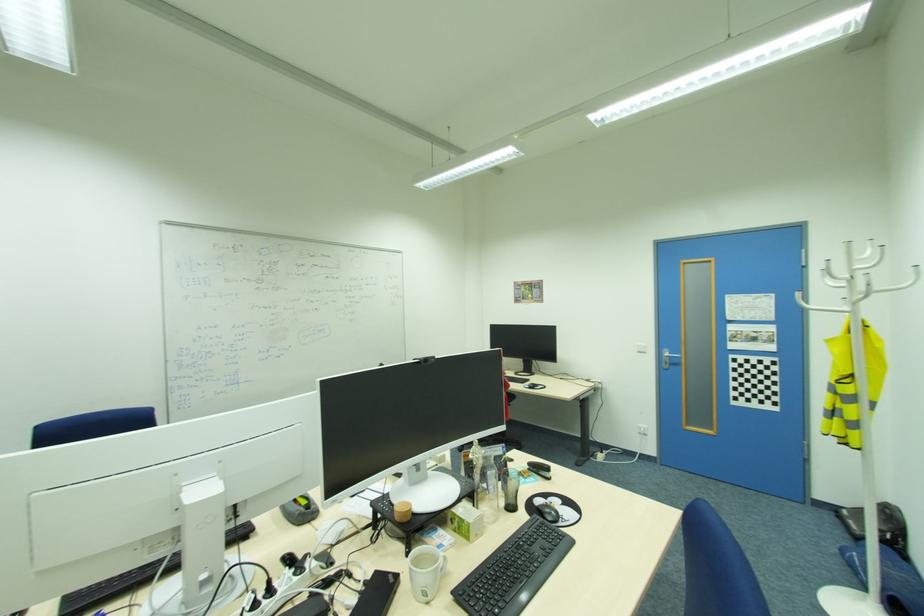
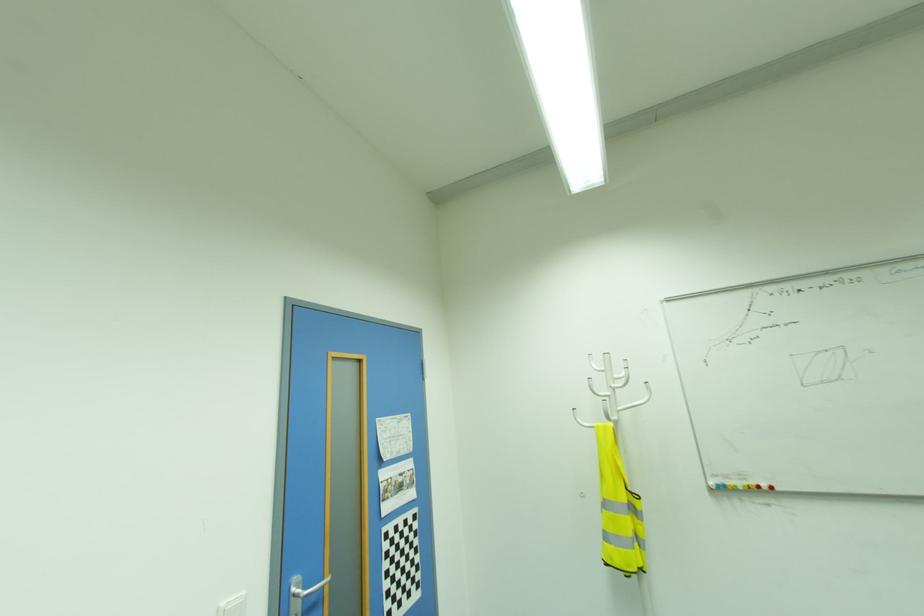
Find the pixel in the second image that matches (640,344) in the first image.

(226, 602)